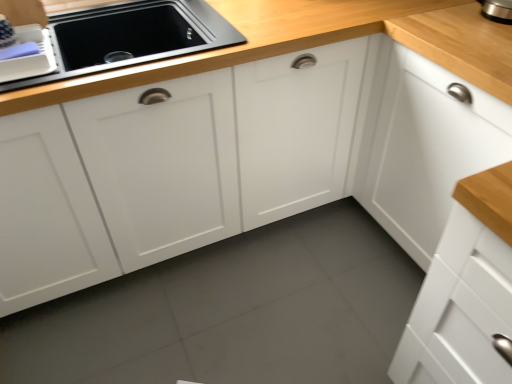
Question: Based on their sizes in the image, would you say matte plastic dish rack at upper left is bigger or smaller than white matte cabinet at upper right?

Choices:
 (A) small
 (B) big

Answer: (A)

Question: Looking at their shapes, would you say matte plastic dish rack at upper left is wider or thinner than white matte cabinet at upper right?

Choices:
 (A) wide
 (B) thin

Answer: (B)

Question: Estimate the real-world distances between objects in this image. Which object is farther from the matte black sink at upper left?

Choices:
 (A) white matte cabinet at upper right
 (B) matte plastic dish rack at upper left

Answer: (A)

Question: Considering the real-world distances, which object is farthest from the matte black sink at upper left?

Choices:
 (A) white matte cabinet at upper right
 (B) matte plastic dish rack at upper left

Answer: (A)